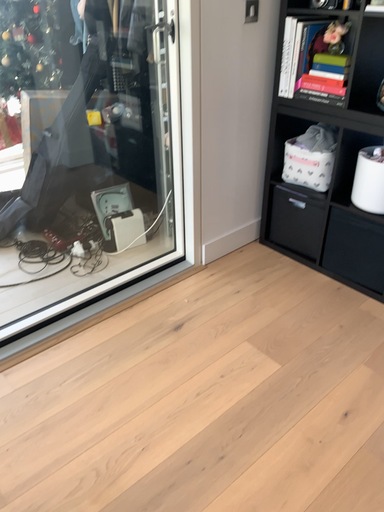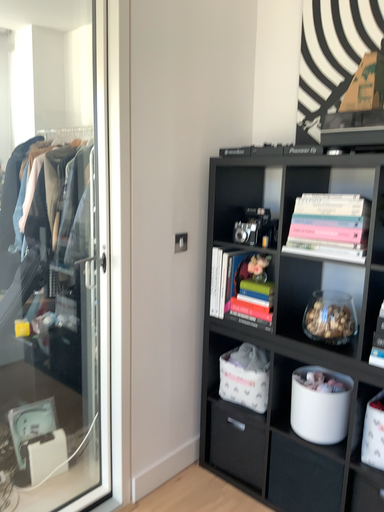
Question: Which way did the camera rotate in the video?

Choices:
 (A) rotated downward
 (B) rotated upward

Answer: (B)